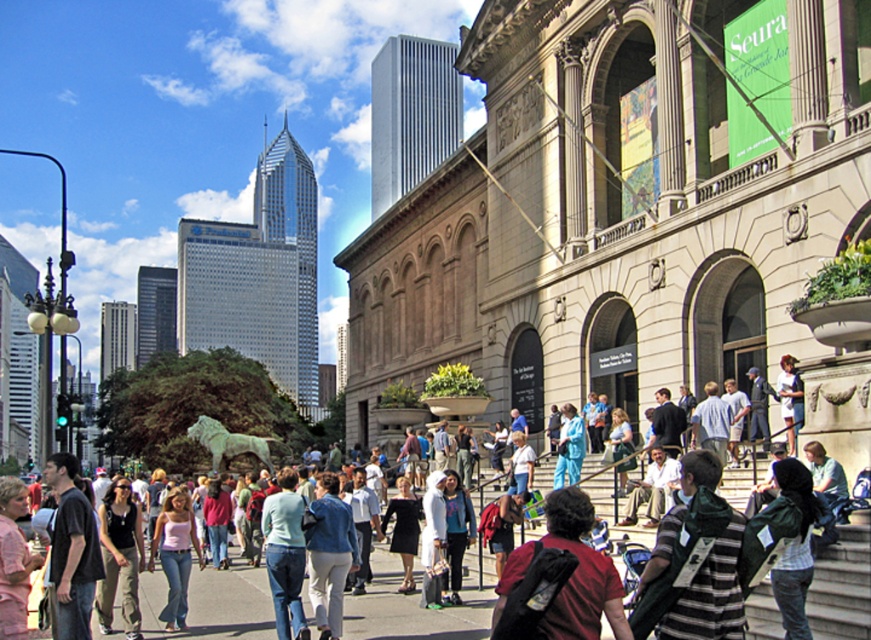
You are standing at the center of the image and want to place a new statue of a lion exactly where the dark green backpack at center is currently located. However, there is already a statue of a lion to the left. Is there enough space between the existing lion statue on the left and the proposed location for the new lion statue to safely place it without overlapping?

The dark green backpack at center is located at point (794, 548), which is towards the lower right of the image. The existing lion statue is on the left side. Since the new location is far from the existing statue, there should be enough space to place the new statue without overlapping.

You are standing in the urban scene described. There is a striped cotton shirt at center. Where is the striped cotton shirt located in the image?

The striped cotton shirt at center is located at the coordinates point (693, 563).